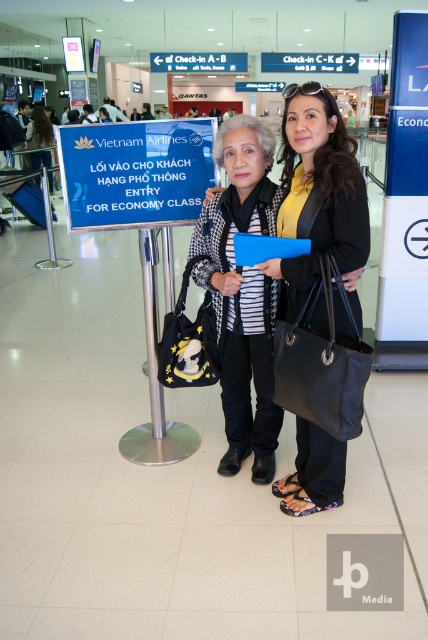
Question: Which point is closer to the camera taking this photo?

Choices:
 (A) (293, 176)
 (B) (41, 109)
 (C) (228, 282)

Answer: (C)

Question: Can you confirm if black leather handbag at center is positioned below black textured coat at center?

Choices:
 (A) yes
 (B) no

Answer: (B)

Question: Is black leather handbag at center bigger than matte black handbag at center?

Choices:
 (A) yes
 (B) no

Answer: (B)

Question: Which object is positioned closest to the matte black handbag at center?

Choices:
 (A) black leather handbag at center
 (B) black textured coat at center

Answer: (B)

Question: Can you confirm if black leather handbag at center is thinner than matte black handbag at center?

Choices:
 (A) yes
 (B) no

Answer: (A)

Question: Which point appears farthest from the camera in this image?

Choices:
 (A) (305, 220)
 (B) (228, 456)
 (C) (51, 189)

Answer: (C)